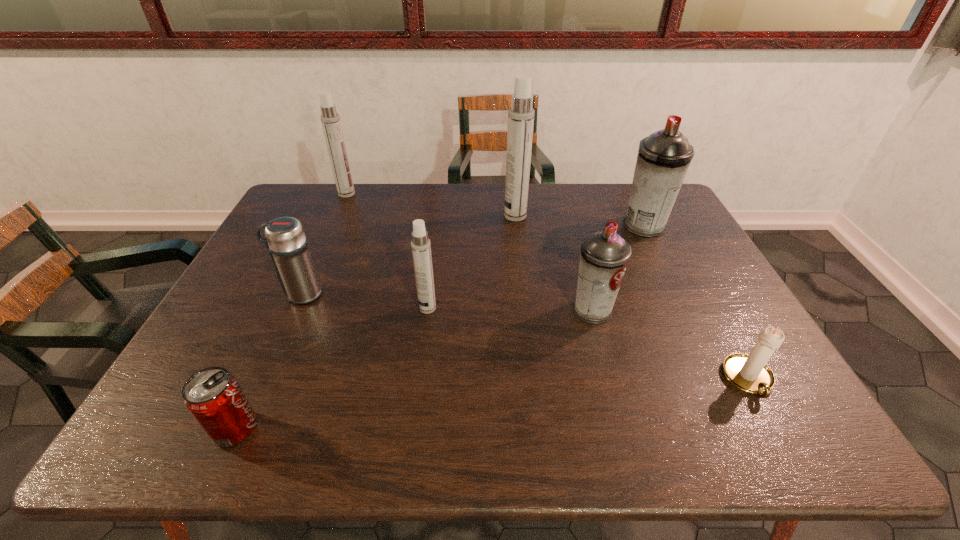
Image resolution: width=960 pixels, height=540 pixels. I want to click on object that is at the far right corner, so click(663, 159).

Identify the location of free region at the far edge of the desktop. tap(537, 201).

At what (x,y) coordinates should I click in order to perform the action: click on vacant space at the near edge of the desktop. Please return your answer as a coordinate pair (x, y). Image resolution: width=960 pixels, height=540 pixels. Looking at the image, I should click on (726, 448).

The height and width of the screenshot is (540, 960). I want to click on vacant space at the left edge of the desktop, so click(252, 272).

Where is `vacant space at the right edge`? The width and height of the screenshot is (960, 540). vacant space at the right edge is located at coordinates (695, 300).

Locate an element on the screen. unoccupied position between the biggest white aerosol can and the smallest white aerosol can is located at coordinates (471, 262).

Locate an element on the screen. This screenshot has width=960, height=540. vacant area between the second nearest object and the right gray aerosol can is located at coordinates (696, 303).

I want to click on vacant space in between the red pop soda and the bigger gray aerosol can, so click(x=440, y=327).

You are a GUI agent. You are given a task and a screenshot of the screen. Output one action in this format:
    pyautogui.click(x=<x>, y=<y>)
    Task: Click on the vacant area that lies between the fifth object from right to left and the sixth tallest object
    
    Given the screenshot: What is the action you would take?
    pyautogui.click(x=365, y=301)

This screenshot has width=960, height=540. Identify the location of empty space between the second white aerosol can from left to right and the tallest aerosol can. (471, 262).